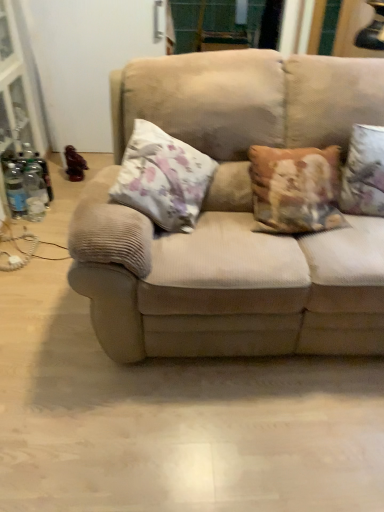
You are a GUI agent. You are given a task and a screenshot of the screen. Output one action in this format:
    pyautogui.click(x=<x>, y=<y>)
    Task: Click on the vacant area that is in front of beige corduroy couch at center
    Image resolution: width=384 pixels, height=512 pixels.
    Given the screenshot: What is the action you would take?
    pyautogui.click(x=241, y=426)